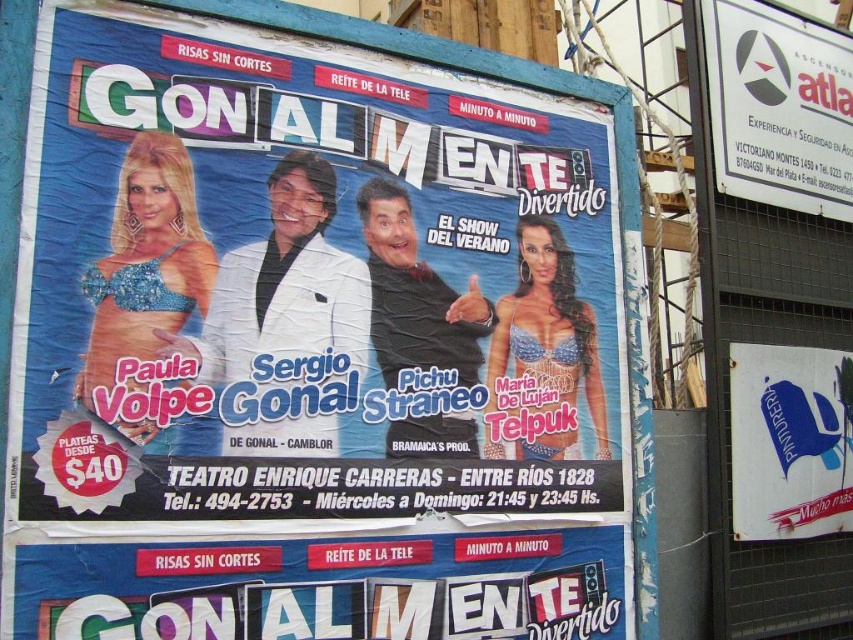
Question: Among these objects, which one is nearest to the camera?

Choices:
 (A) blue paper poster at upper left
 (B) white plastic sign at upper right
 (C) white plastic sign at lower right
 (D) blue cardboard sign at center

Answer: (D)

Question: Which of the following is the closest to the observer?

Choices:
 (A) white plastic sign at lower right
 (B) white plastic sign at upper right
 (C) blue cardboard sign at center
 (D) blue paper poster at upper left

Answer: (C)

Question: Is blue paper poster at upper left bigger than white plastic sign at lower right?

Choices:
 (A) yes
 (B) no

Answer: (A)

Question: Which is nearer to the blue cardboard sign at center?

Choices:
 (A) white plastic sign at lower right
 (B) white plastic sign at upper right
 (C) blue paper poster at upper left

Answer: (C)

Question: Is blue paper poster at upper left below white plastic sign at lower right?

Choices:
 (A) yes
 (B) no

Answer: (B)

Question: Does blue cardboard sign at center appear on the left side of white plastic sign at lower right?

Choices:
 (A) yes
 (B) no

Answer: (A)